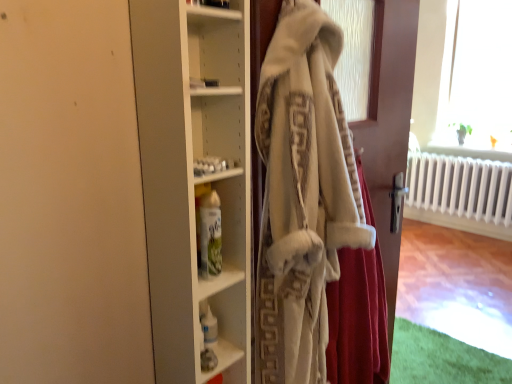
Question: Does white glossy spray can at center, acting as the 2th shelf starting from the bottom, appear on the right side of white fluffy bathrobe at center?

Choices:
 (A) yes
 (B) no

Answer: (B)

Question: From the image's perspective, does white glossy spray can at center, acting as the 2th shelf starting from the bottom, appear lower than white fluffy bathrobe at center?

Choices:
 (A) no
 (B) yes

Answer: (A)

Question: From a real-world perspective, is white glossy spray can at center, which ranks as the first shelf in front-to-back order, below white fluffy bathrobe at center?

Choices:
 (A) yes
 (B) no

Answer: (B)

Question: Can you confirm if white glossy spray can at center, acting as the 2th shelf starting from the bottom, is smaller than white fluffy bathrobe at center?

Choices:
 (A) no
 (B) yes

Answer: (B)

Question: Is white fluffy bathrobe at center at the back of white glossy spray can at center, marked as the 1th shelf in a top-to-bottom arrangement?

Choices:
 (A) no
 (B) yes

Answer: (A)

Question: Does white glossy spray can at center, positioned as the second shelf in back-to-front order, have a larger size compared to white fluffy bathrobe at center?

Choices:
 (A) no
 (B) yes

Answer: (A)

Question: Can you confirm if white glossy spray can at center, marked as the 1th shelf in a top-to-bottom arrangement, is shorter than fuzzy white shawl at center?

Choices:
 (A) no
 (B) yes

Answer: (B)

Question: Is white glossy spray can at center, which ranks as the first shelf in front-to-back order, at the left side of fuzzy white shawl at center?

Choices:
 (A) yes
 (B) no

Answer: (A)

Question: Is white glossy spray can at center, acting as the 2th shelf starting from the bottom, not close to fuzzy white shawl at center?

Choices:
 (A) no
 (B) yes

Answer: (A)

Question: Can you confirm if white glossy spray can at center, positioned as the second shelf in back-to-front order, is bigger than fuzzy white shawl at center?

Choices:
 (A) yes
 (B) no

Answer: (B)

Question: From the image's perspective, is white glossy spray can at center, which ranks as the first shelf in front-to-back order, below fuzzy white shawl at center?

Choices:
 (A) no
 (B) yes

Answer: (A)

Question: Could you tell me if white glossy spray can at center, positioned as the second shelf in back-to-front order, is facing fuzzy white shawl at center?

Choices:
 (A) no
 (B) yes

Answer: (A)

Question: From a real-world perspective, is fuzzy white shawl at center physically above white fluffy bathrobe at center?

Choices:
 (A) yes
 (B) no

Answer: (B)